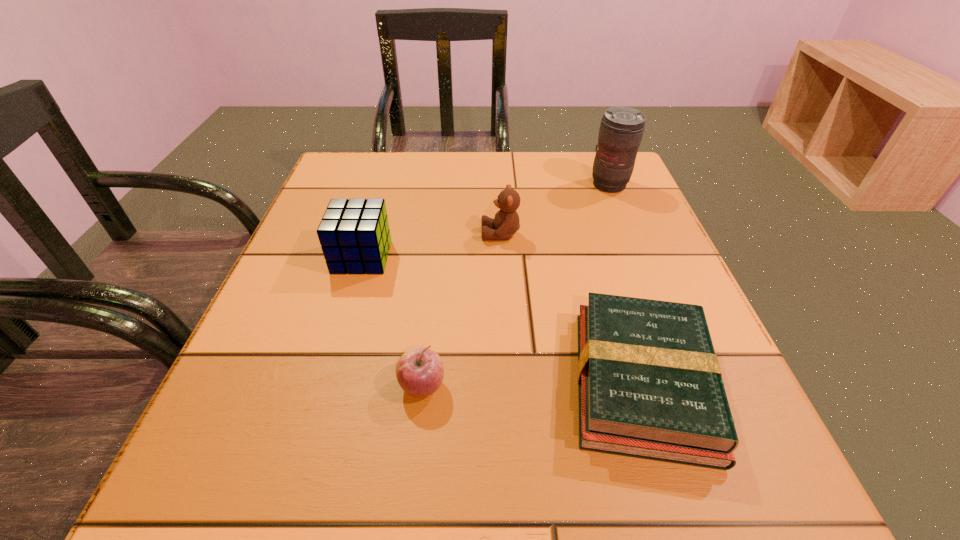
You are a GUI agent. You are given a task and a screenshot of the screen. Output one action in this format:
    pyautogui.click(x=<x>, y=<y>)
    Task: Click on the object that is at the near right corner
    The width and height of the screenshot is (960, 540).
    Given the screenshot: What is the action you would take?
    pyautogui.click(x=650, y=386)

The width and height of the screenshot is (960, 540). In the image, there is a desktop. Find the location of `vacant space at the far edge`. vacant space at the far edge is located at coordinates (441, 169).

This screenshot has height=540, width=960. In the image, there is a desktop. Find the location of `vacant area at the near edge`. vacant area at the near edge is located at coordinates [x=547, y=480].

Locate an element on the screen. vacant region at the left edge of the desktop is located at coordinates (320, 252).

Locate an element on the screen. The width and height of the screenshot is (960, 540). free space at the far left corner of the desktop is located at coordinates (333, 160).

The height and width of the screenshot is (540, 960). What are the coordinates of `free space at the near left corner of the desktop` in the screenshot? It's located at (219, 502).

You are a GUI agent. You are given a task and a screenshot of the screen. Output one action in this format:
    pyautogui.click(x=<x>, y=<y>)
    Task: Click on the free region at the far right corner of the desktop
    
    Given the screenshot: What is the action you would take?
    pyautogui.click(x=587, y=185)

In the image, there is a desktop. Find the location of `free space at the near right corner`. free space at the near right corner is located at coordinates (700, 469).

Locate an element on the screen. free spot between the hardback book and the third object from left to right is located at coordinates (571, 308).

I want to click on empty space that is in between the hardback book and the third object from left to right, so coord(571,308).